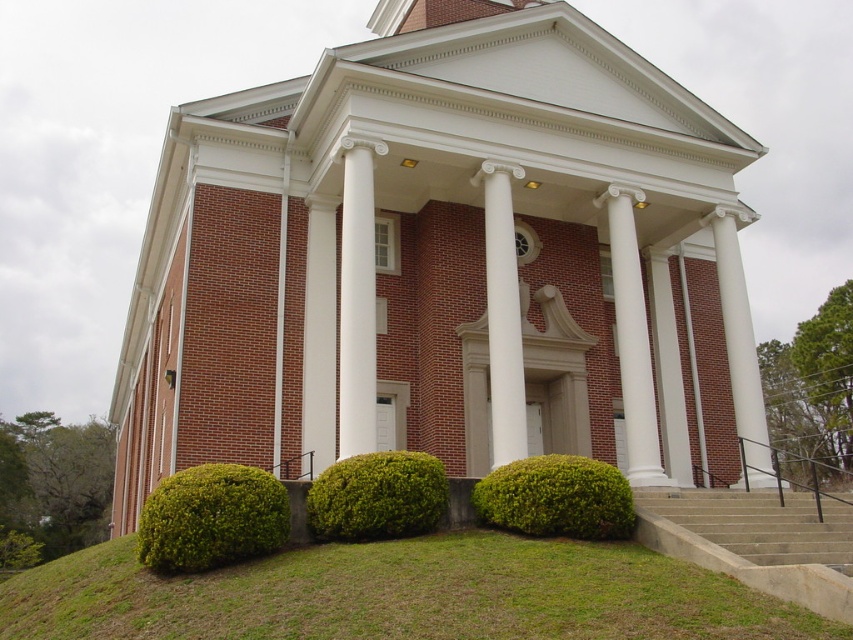
Question: Does green leafy bush at lower center appear on the left side of green leafy hedge at lower center?

Choices:
 (A) no
 (B) yes

Answer: (A)

Question: Which point is closer to the camera?

Choices:
 (A) (486, 273)
 (B) (779, 529)
 (C) (332, 467)
 (D) (265, 497)

Answer: (D)

Question: Does green leafy bush at lower left have a smaller size compared to concrete stairs at lower right?

Choices:
 (A) yes
 (B) no

Answer: (B)

Question: Can you confirm if green grass at lower center is positioned above white marble column at center?

Choices:
 (A) yes
 (B) no

Answer: (B)

Question: Which object is closer to the camera taking this photo?

Choices:
 (A) green leafy bush at lower center
 (B) concrete stairs at lower right
 (C) green grass at lower center
 (D) green leafy bush at lower left

Answer: (C)

Question: Which object is positioned closest to the green leafy bush at lower left?

Choices:
 (A) green grass at lower center
 (B) white marble column at center

Answer: (A)